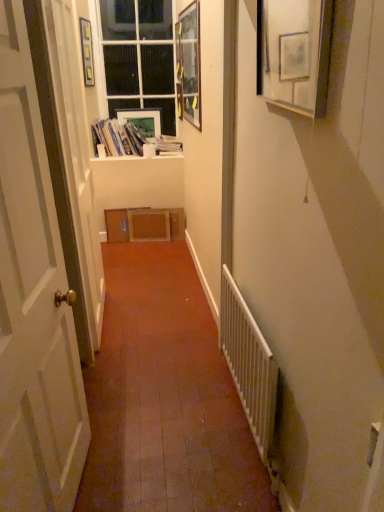
Question: Does white glossy door at left have a smaller size compared to wooden picture frame at upper right, arranged as the first picture frame when viewed from the front?

Choices:
 (A) yes
 (B) no

Answer: (B)

Question: Is white glossy door at left touching wooden picture frame at upper right, which is the 4th picture frame from left to right?

Choices:
 (A) yes
 (B) no

Answer: (B)

Question: Does white glossy door at left turn towards wooden picture frame at upper right, which is the 1th picture frame in right-to-left order?

Choices:
 (A) yes
 (B) no

Answer: (A)

Question: Can you confirm if white glossy door at left is bigger than wooden picture frame at upper right, arranged as the first picture frame when viewed from the front?

Choices:
 (A) no
 (B) yes

Answer: (B)

Question: Can you confirm if white glossy door at left is positioned to the left of wooden picture frame at upper right, arranged as the first picture frame when viewed from the front?

Choices:
 (A) yes
 (B) no

Answer: (A)

Question: Is white glossy door at left situated inside white metal radiator at lower right or outside?

Choices:
 (A) inside
 (B) outside

Answer: (B)

Question: Is white glossy door at left to the left or to the right of white metal radiator at lower right in the image?

Choices:
 (A) right
 (B) left

Answer: (B)

Question: From a real-world perspective, is white glossy door at left physically located above or below white metal radiator at lower right?

Choices:
 (A) above
 (B) below

Answer: (A)

Question: Considering the positions of point (31, 103) and point (269, 423), is point (31, 103) closer or farther from the camera than point (269, 423)?

Choices:
 (A) closer
 (B) farther

Answer: (A)

Question: Is white paper stack at upper center in front of or behind white glossy door at left in the image?

Choices:
 (A) behind
 (B) front

Answer: (A)

Question: Is white paper stack at upper center inside or outside of white glossy door at left?

Choices:
 (A) outside
 (B) inside

Answer: (A)

Question: From a real-world perspective, is white paper stack at upper center physically located above or below white glossy door at left?

Choices:
 (A) above
 (B) below

Answer: (A)

Question: Visually, is white paper stack at upper center positioned to the left or to the right of white glossy door at left?

Choices:
 (A) left
 (B) right

Answer: (A)

Question: From their relative heights in the image, would you say matte black picture frame at upper left, which ranks as the 3th picture frame in front-to-back order, is taller or shorter than matte plastic picture frame at upper center, the third picture frame when ordered from right to left?

Choices:
 (A) tall
 (B) short

Answer: (A)

Question: Is matte black picture frame at upper left, which ranks as the 3th picture frame in front-to-back order, spatially inside matte plastic picture frame at upper center, marked as the 4th picture frame in a front-to-back arrangement, or outside of it?

Choices:
 (A) inside
 (B) outside

Answer: (B)